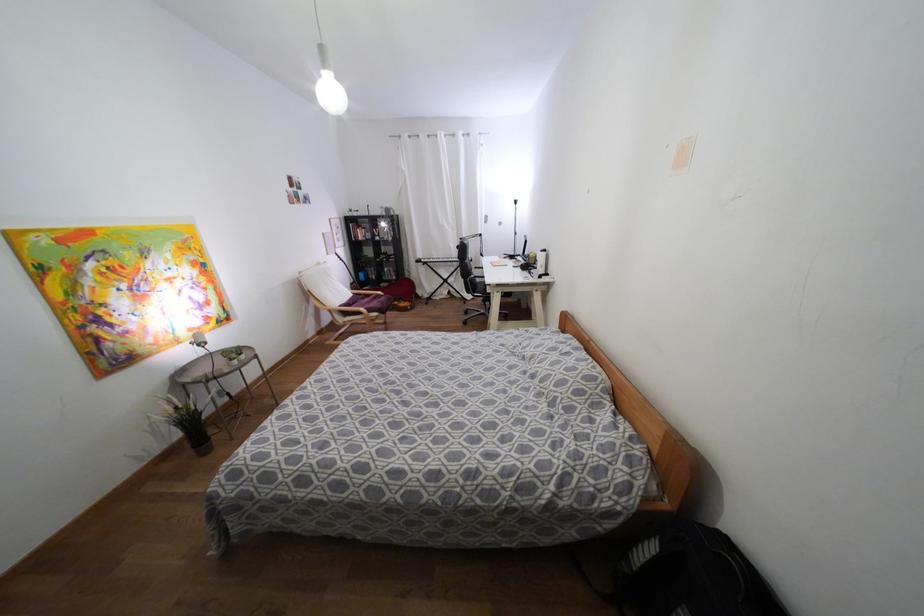
This screenshot has width=924, height=616. What are the coordinates of `large black bag` in the screenshot? It's located at (693, 576).